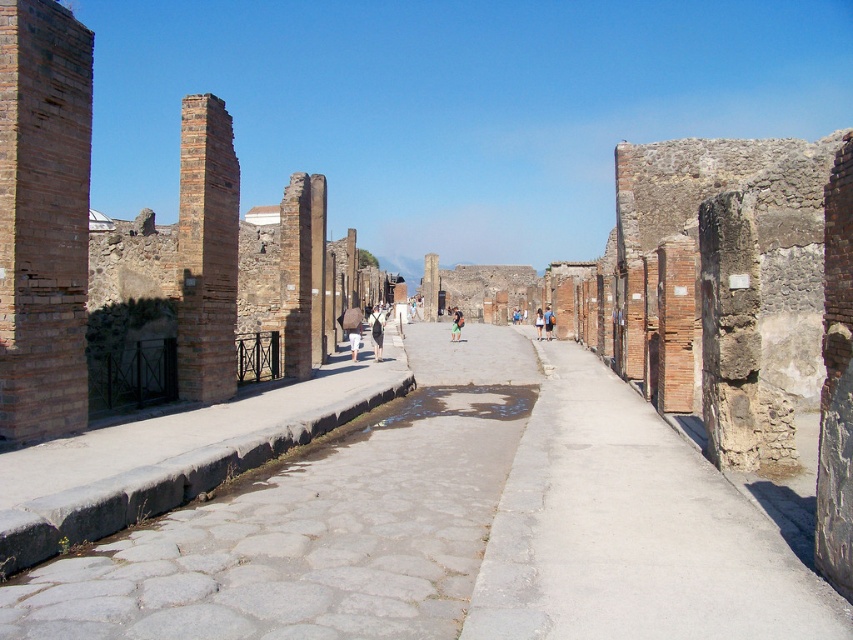
This screenshot has height=640, width=853. What do you see at coordinates (143, 256) in the screenshot?
I see `brick wall at left` at bounding box center [143, 256].

Does point (9, 376) come behind point (538, 332)?

No, (9, 376) is closer to viewer.

Find the location of `brick wall at left`. brick wall at left is located at coordinates click(x=143, y=256).

Does brown brick pillar at left appear on the left side of light brown leather bag at center?

Indeed, brown brick pillar at left is positioned on the left side of light brown leather bag at center.

Does brown brick pillar at left appear under light brown leather bag at center?

Incorrect, brown brick pillar at left is not positioned below light brown leather bag at center.

Locate an element on the screen. brown brick pillar at left is located at coordinates (206, 252).

Based on the photo, who is taller, brick wall at left or light brown leather backpack at center?

With more height is brick wall at left.

From the picture: Who is positioned more to the left, brick wall at left or light brown leather backpack at center?

brick wall at left is more to the left.

Between point (93, 336) and point (550, 307), which one is positioned in front?

Point (93, 336)

In order to click on brick wall at left in this screenshot , I will do [143, 256].